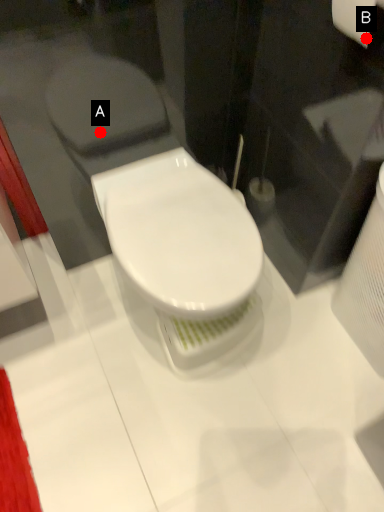
Question: Two points are circled on the image, labeled by A and B beside each circle. Which point is further to the camera?

Choices:
 (A) A is further
 (B) B is further

Answer: (A)